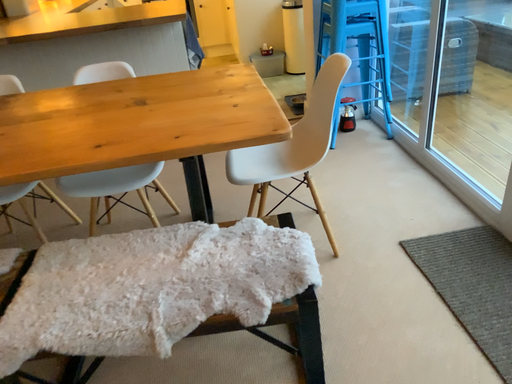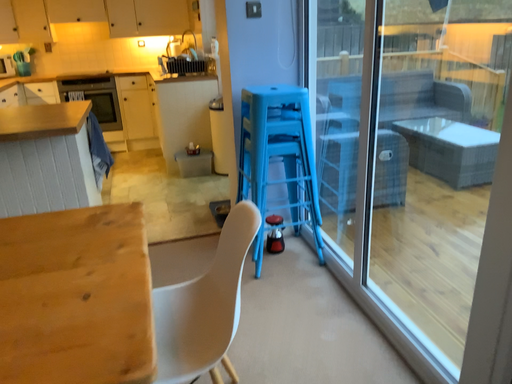
Question: Which way did the camera rotate in the video?

Choices:
 (A) rotated right
 (B) rotated left

Answer: (A)